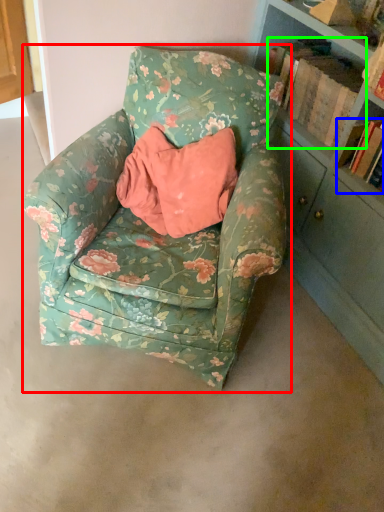
Question: Considering the real-world distances, which object is farthest from chair (highlighted by a red box)? book (highlighted by a blue box) or book (highlighted by a green box)?

Choices:
 (A) book
 (B) book

Answer: (A)